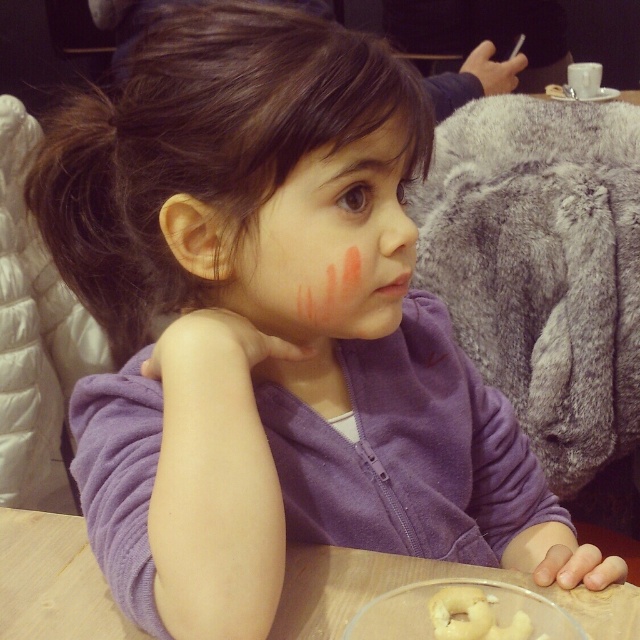
Is fuzzy gray stuffed animal at right thinner than wooden table at lower center?

Indeed, fuzzy gray stuffed animal at right has a lesser width compared to wooden table at lower center.

Which is above, fuzzy gray stuffed animal at right or wooden table at lower center?

fuzzy gray stuffed animal at right

The height and width of the screenshot is (640, 640). I want to click on fuzzy gray stuffed animal at right, so click(541, 268).

Based on the photo, can you confirm if fuzzy gray stuffed animal at right is bigger than matte pink blush at center?

Yes.

Identify the location of fuzzy gray stuffed animal at right. (541, 268).

Does wooden table at lower center have a lesser width compared to white doughnut at lower center?

In fact, wooden table at lower center might be wider than white doughnut at lower center.

Describe the element at coordinates (413, 580) in the screenshot. The image size is (640, 640). I see `wooden table at lower center` at that location.

Who is more distant from viewer, (x=77, y=525) or (x=442, y=604)?

The point (x=77, y=525) is behind.

Find the location of a particular element. The image size is (640, 640). wooden table at lower center is located at coordinates (413, 580).